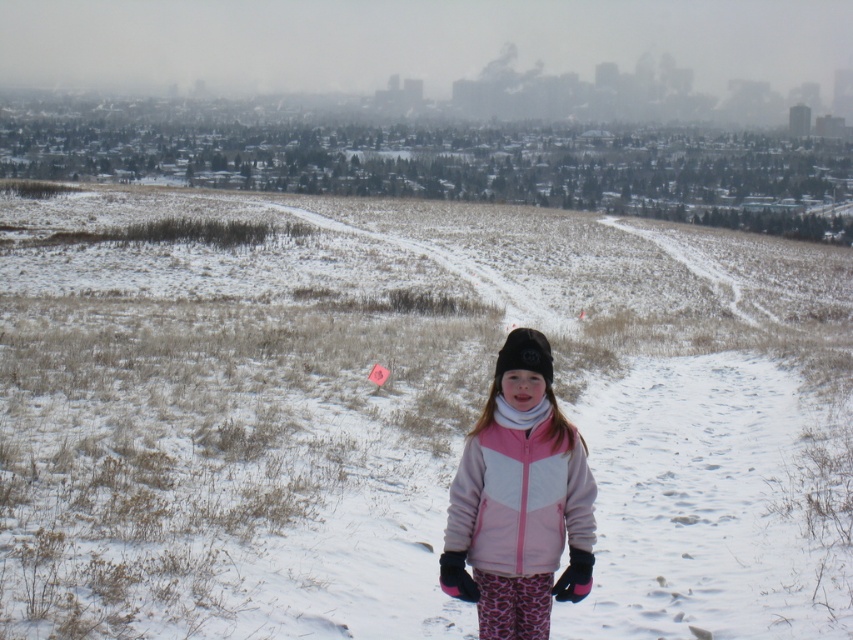
Does point (601, 262) come behind point (502, 493)?

Yes.

In the scene shown: Who is more distant from viewer, (364,534) or (453,481)?

The point (364,534) is more distant.

Describe the element at coordinates (404, 412) in the screenshot. I see `white fluffy snow at center` at that location.

Locate an element on the screen. white fluffy snow at center is located at coordinates (404, 412).